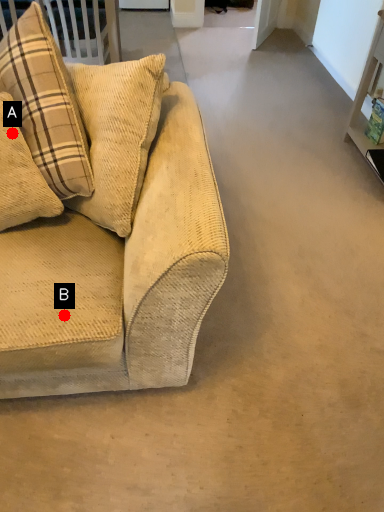
Question: Two points are circled on the image, labeled by A and B beside each circle. Which point is farther from the camera taking this photo?

Choices:
 (A) A is further
 (B) B is further

Answer: (A)